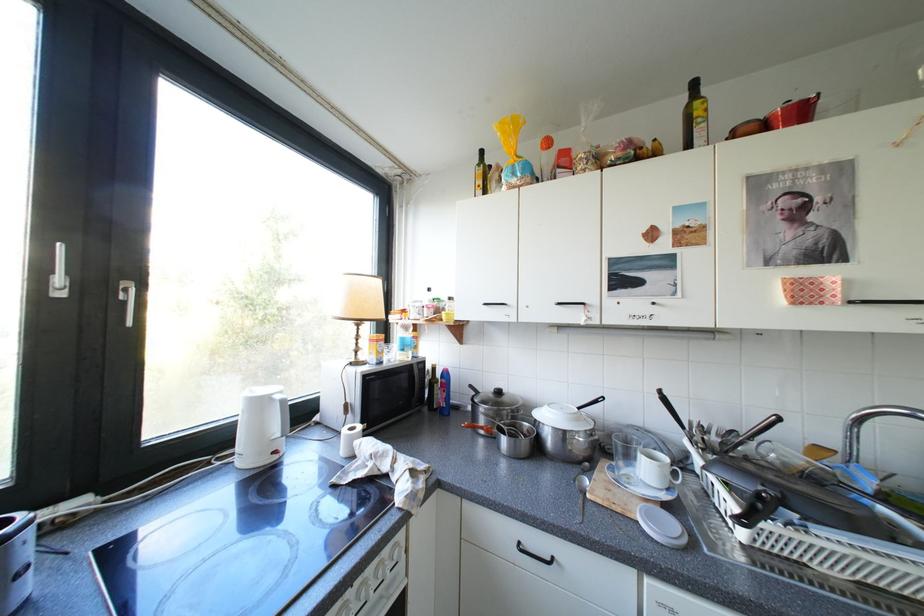
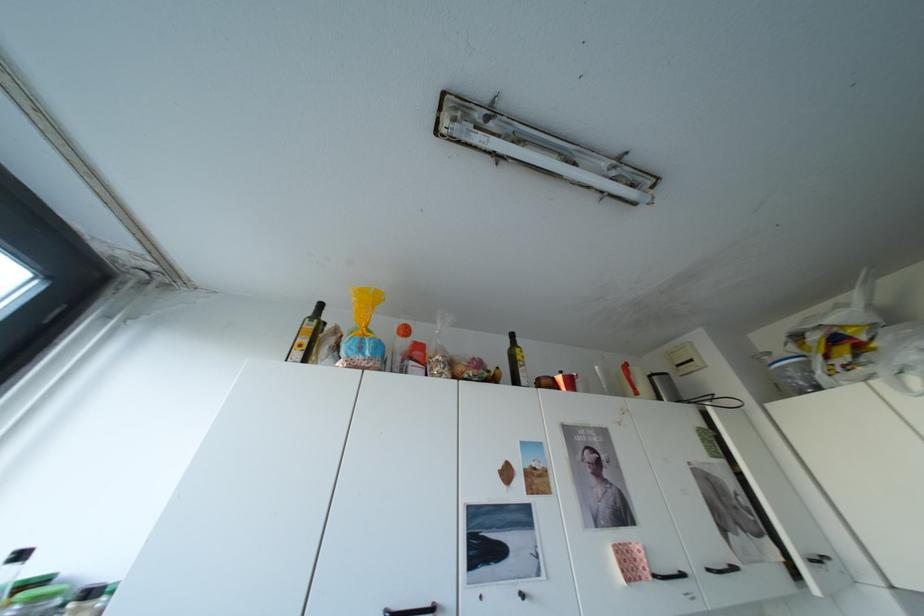
Locate, in the second image, the point that corresponds to (667,140) in the first image.

(511, 368)